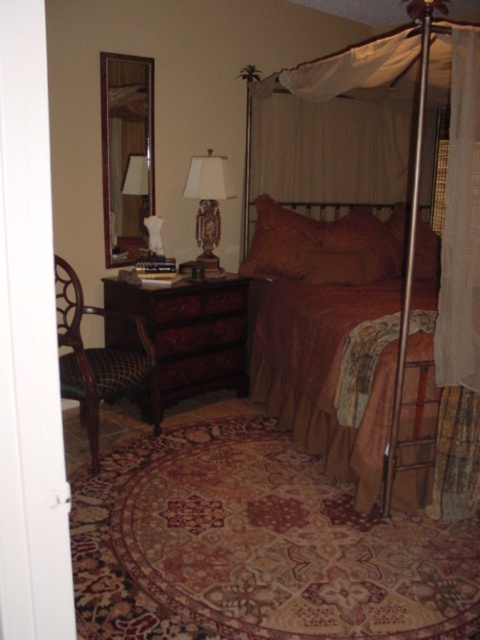
Is sheer white curtain at right above brown wood drawer at left?

Yes.

Can you confirm if sheer white curtain at right is taller than brown wood drawer at left?

Indeed, sheer white curtain at right has a greater height compared to brown wood drawer at left.

Where is `sheer white curtain at right`? sheer white curtain at right is located at coordinates (460, 224).

Locate an element on the screen. The height and width of the screenshot is (640, 480). sheer white curtain at right is located at coordinates (460, 224).

Can you confirm if sheer white curtain at right is positioned below brown wood drawer at center?

Actually, sheer white curtain at right is above brown wood drawer at center.

Is sheer white curtain at right positioned at the back of brown wood drawer at center?

No, sheer white curtain at right is in front of brown wood drawer at center.

Does point (456, 65) come farther from viewer compared to point (229, 300)?

No, (456, 65) is in front of (229, 300).

I want to click on sheer white curtain at right, so click(x=460, y=224).

Is the position of matte brown fabric canopy bed at center more distant than that of green plaid chair at left?

No.

Is matte brown fabric canopy bed at center smaller than green plaid chair at left?

No.

Between point (403, 419) and point (158, 408), which one is positioned in front?

Point (403, 419) is in front.

In order to click on matte brown fabric canopy bed at center in this screenshot , I will do `click(321, 342)`.